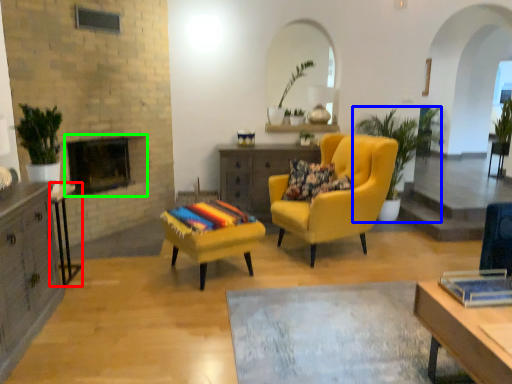
Question: Which object is positioned closest to table (highlighted by a red box)? Select from houseplant (highlighted by a blue box) and fireplace (highlighted by a green box).

Choices:
 (A) houseplant
 (B) fireplace

Answer: (B)